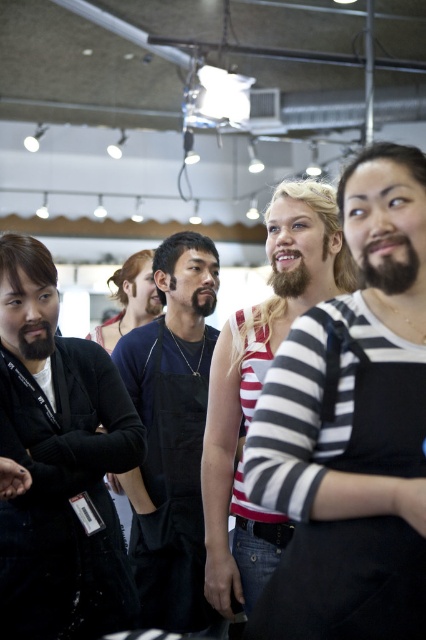
Question: Does black matte apron at center have a greater width compared to blondehairbeard at center?

Choices:
 (A) yes
 (B) no

Answer: (B)

Question: Where is black matte apron at center located in relation to blondehairbeard at center in the image?

Choices:
 (A) above
 (B) below

Answer: (B)

Question: Which point is closer to the camera?

Choices:
 (A) (42, 355)
 (B) (268, 243)
 (C) (184, 584)

Answer: (A)

Question: Which of these objects is positioned farthest from the blondehairbeard at center?

Choices:
 (A) black matte jacket at left
 (B) black matte apron at center

Answer: (B)

Question: Can you confirm if black matte jacket at left is bigger than blondehairbeard at center?

Choices:
 (A) yes
 (B) no

Answer: (B)

Question: Which point is closer to the camera taking this photo?

Choices:
 (A) (144, 593)
 (B) (236, 420)
 (C) (109, 428)

Answer: (C)